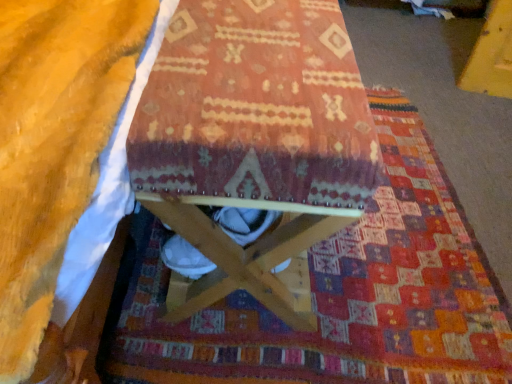
Question: Is point (67, 79) closer or farther from the camera than point (195, 180)?

Choices:
 (A) closer
 (B) farther

Answer: (B)

Question: Considering the relative positions of soft yellow blanket at lower left and wooden stool at center in the image provided, is soft yellow blanket at lower left to the left or to the right of wooden stool at center?

Choices:
 (A) left
 (B) right

Answer: (A)

Question: Which is nearer to the wooden stool at center?

Choices:
 (A) soft yellow blanket at lower left
 (B) textured woolen mat at center

Answer: (A)

Question: Considering the real-world distances, which object is closest to the textured woolen mat at center?

Choices:
 (A) soft yellow blanket at lower left
 (B) wooden stool at center

Answer: (B)